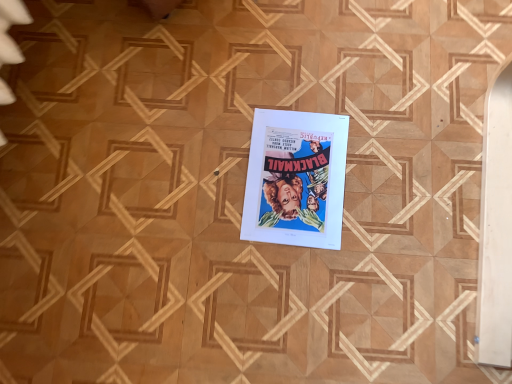
I want to click on free space above matte paper poster at center (from a real-world perspective), so point(297,176).